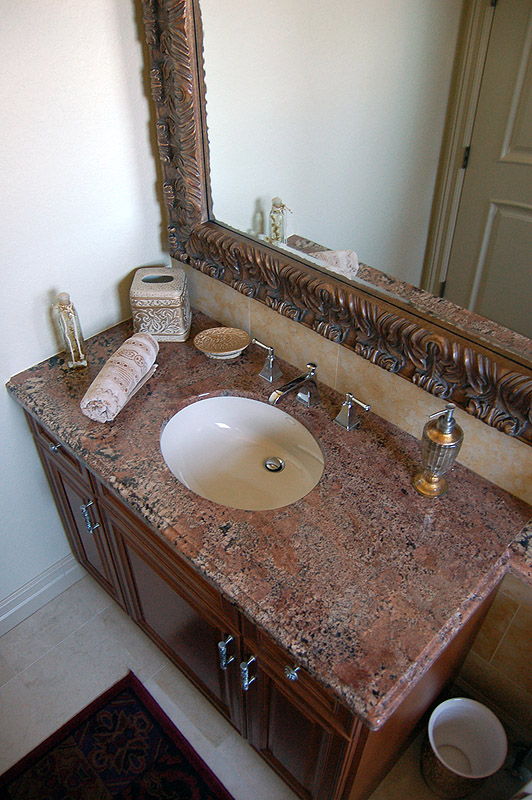
Identify the location of large mirror. (390, 136).